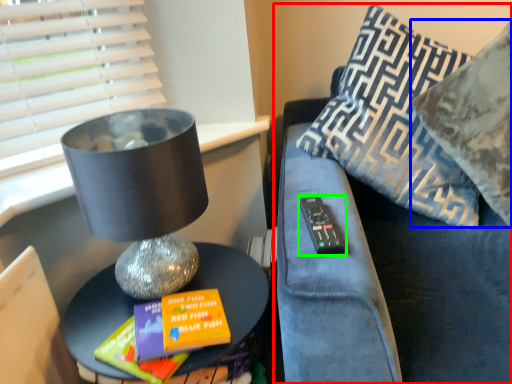
Question: Which is farther away from furniture (highlighted by a red box)? pillow (highlighted by a blue box) or remote (highlighted by a green box)?

Choices:
 (A) pillow
 (B) remote

Answer: (A)